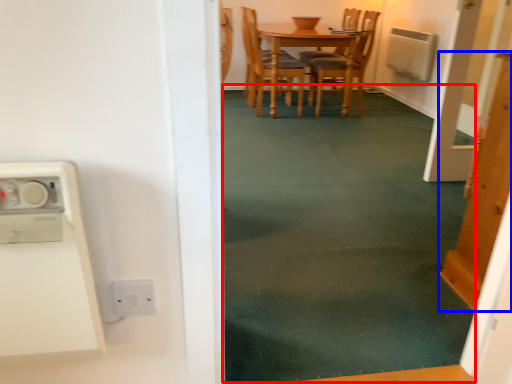
Question: Which point is further to the camera, plain (highlighted by a red box) or door (highlighted by a blue box)?

Choices:
 (A) plain
 (B) door

Answer: (A)